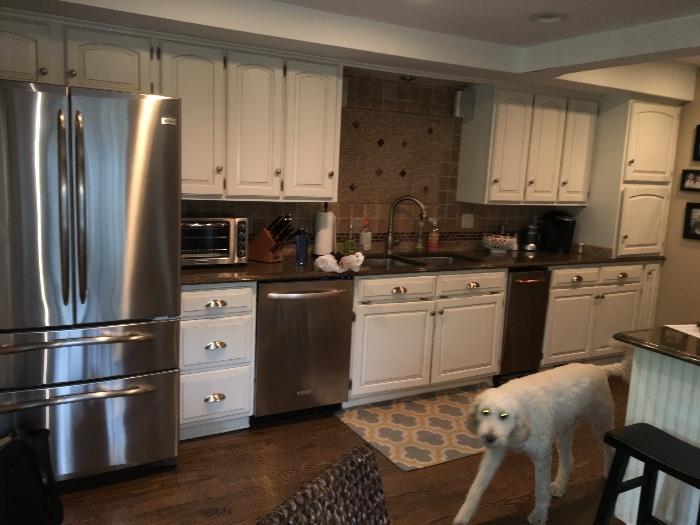
You are a GUI agent. You are given a task and a screenshot of the screen. Output one action in this format:
    pyautogui.click(x=<x>, y=<y>)
    Task: Click on the toaster oven
    The image size is (700, 525).
    Given the screenshot: What is the action you would take?
    click(x=206, y=245)